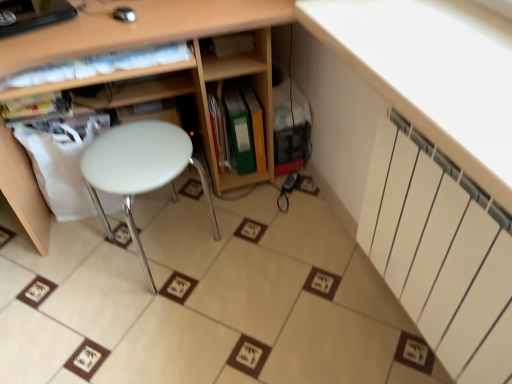
Question: Is green matte folder at center, the third book from the left, positioned with its back to green matte folder at center, positioned as the second book in left-to-right order?

Choices:
 (A) no
 (B) yes

Answer: (A)

Question: Does green matte folder at center, the third book from the left, have a larger size compared to green matte folder at center, which appears as the 2th book when viewed from the right?

Choices:
 (A) no
 (B) yes

Answer: (B)

Question: Is green matte folder at center, positioned as the first book in right-to-left order, positioned before green matte folder at center, positioned as the second book in left-to-right order?

Choices:
 (A) no
 (B) yes

Answer: (A)

Question: Considering the relative sizes of green matte folder at center, positioned as the first book in right-to-left order, and green matte folder at center, which appears as the 2th book when viewed from the right, in the image provided, is green matte folder at center, positioned as the first book in right-to-left order, shorter than green matte folder at center, which appears as the 2th book when viewed from the right,?

Choices:
 (A) no
 (B) yes

Answer: (B)

Question: From the image's perspective, is green matte folder at center, the third book from the left, on top of green matte folder at center, which appears as the 2th book when viewed from the right?

Choices:
 (A) no
 (B) yes

Answer: (B)

Question: Based on their sizes in the image, would you say white glossy radiator at upper right is bigger or smaller than white plastic stool at center?

Choices:
 (A) big
 (B) small

Answer: (B)

Question: From their relative heights in the image, would you say white glossy radiator at upper right is taller or shorter than white plastic stool at center?

Choices:
 (A) short
 (B) tall

Answer: (A)

Question: From a real-world perspective, is white glossy radiator at upper right physically located above or below white plastic stool at center?

Choices:
 (A) above
 (B) below

Answer: (A)

Question: In the image, is white glossy radiator at upper right on the left side or the right side of white plastic stool at center?

Choices:
 (A) right
 (B) left

Answer: (A)

Question: Is white matte radiator at upper right wider or thinner than white plastic stool at center?

Choices:
 (A) thin
 (B) wide

Answer: (A)

Question: Visually, is white matte radiator at upper right positioned to the left or to the right of white plastic stool at center?

Choices:
 (A) right
 (B) left

Answer: (A)

Question: Considering the positions of white matte radiator at upper right and white plastic stool at center in the image, is white matte radiator at upper right bigger or smaller than white plastic stool at center?

Choices:
 (A) big
 (B) small

Answer: (B)

Question: In the image, is white matte radiator at upper right positioned in front of or behind white plastic stool at center?

Choices:
 (A) front
 (B) behind

Answer: (A)

Question: Would you say white glossy radiator at upper right is inside or outside green matte folder at center, positioned as the second book in left-to-right order?

Choices:
 (A) outside
 (B) inside

Answer: (A)

Question: Is white glossy radiator at upper right wider or thinner than green matte folder at center, which appears as the 2th book when viewed from the right?

Choices:
 (A) wide
 (B) thin

Answer: (A)